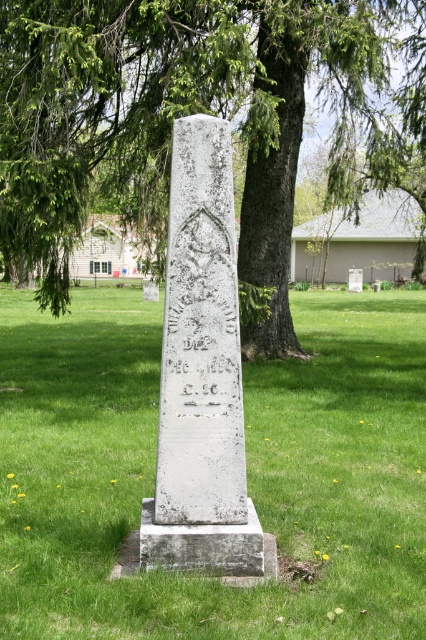
Question: Considering the relative positions of green leafy tree at center and white stone monument at center in the image provided, where is green leafy tree at center located with respect to white stone monument at center?

Choices:
 (A) left
 (B) right

Answer: (B)

Question: Among these objects, which one is farthest from the camera?

Choices:
 (A) green leafy tree at center
 (B) white stone monument at center
 (C) green grass at center

Answer: (A)

Question: Which point is farther to the camera?

Choices:
 (A) [118, 586]
 (B) [227, 557]

Answer: (B)

Question: In this image, where is green leafy tree at center located relative to white stone monument at center?

Choices:
 (A) left
 (B) right

Answer: (B)

Question: Which point is farther to the camera?

Choices:
 (A) green leafy tree at center
 (B) white stone monument at center
 (C) green grass at center

Answer: (A)

Question: Is green grass at center positioned in front of green leafy tree at center?

Choices:
 (A) yes
 (B) no

Answer: (A)